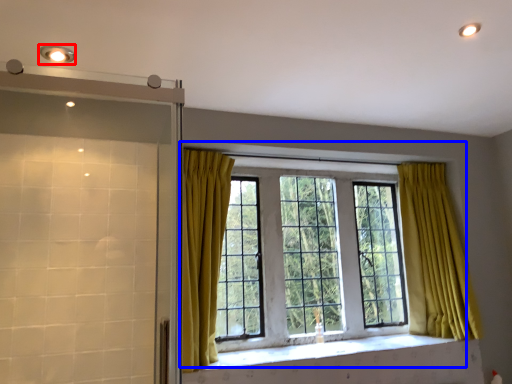
Question: Which object appears farthest to the camera in this image, light fixture (highlighted by a red box) or window (highlighted by a blue box)?

Choices:
 (A) light fixture
 (B) window

Answer: (B)